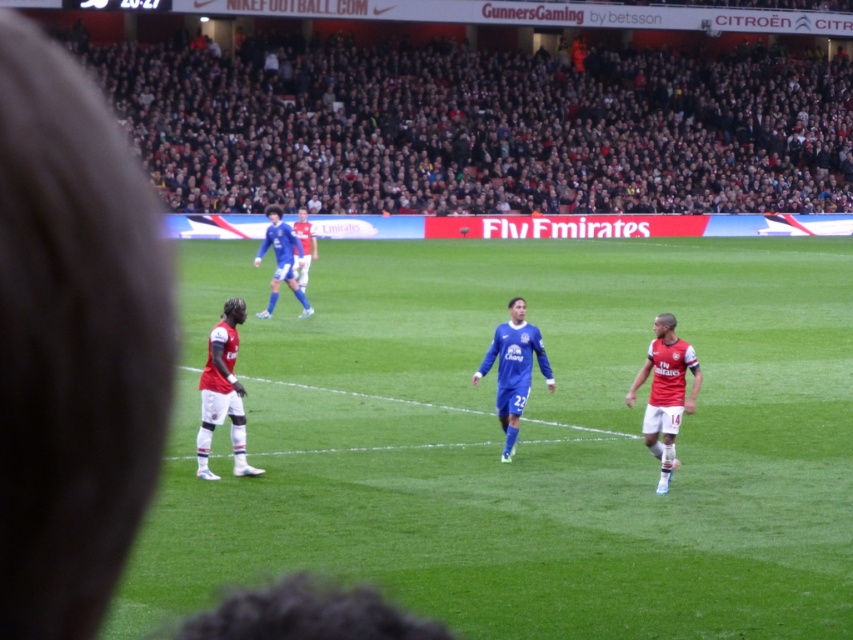
Question: Which point is closer to the camera?

Choices:
 (A) green grass field at center
 (B) blue smooth soccer player at center
 (C) white jersey at left
 (D) blue jersey at center

Answer: (A)

Question: Which object appears farthest from the camera in this image?

Choices:
 (A) blue jersey at center
 (B) white jersey at right

Answer: (A)

Question: Can you confirm if green grass field at center is thinner than dark gray crowd at upper center?

Choices:
 (A) yes
 (B) no

Answer: (A)

Question: Does white jersey at left appear over blue jersey at center?

Choices:
 (A) no
 (B) yes

Answer: (B)

Question: Can you confirm if dark gray crowd at upper center is thinner than white jersey at left?

Choices:
 (A) yes
 (B) no

Answer: (B)

Question: Which of the following is the farthest from the observer?

Choices:
 (A) dark gray crowd at upper center
 (B) blue jersey at center
 (C) white jersey at right

Answer: (A)